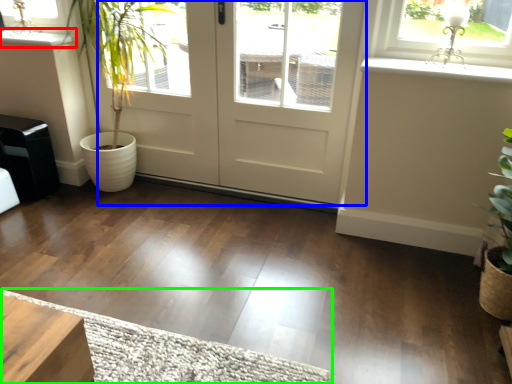
Question: Considering the real-world distances, which object is farthest from window sill (highlighted by a red box)? door (highlighted by a blue box) or doormat (highlighted by a green box)?

Choices:
 (A) door
 (B) doormat

Answer: (B)